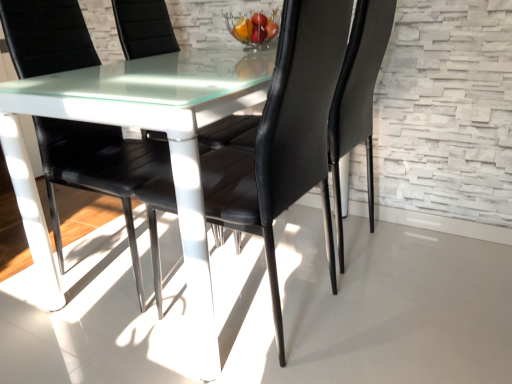
Question: Is black leather chair at center, the first chair viewed from the right, inside the boundaries of black leather chair at center, which is the 4th chair from right to left, or outside?

Choices:
 (A) outside
 (B) inside

Answer: (A)

Question: From the image's perspective, is black leather chair at center, the fourth chair in the left-to-right sequence, above or below black leather chair at center, the first chair positioned from the left?

Choices:
 (A) below
 (B) above

Answer: (B)

Question: Which object is the farthest from the black leather chair at center, arranged as the second chair when viewed from the right?

Choices:
 (A) black leather chair at center, the fourth chair in the left-to-right sequence
 (B) black leather chair at center, marked as the 2th chair in a left-to-right arrangement
 (C) black leather chair at center, the first chair positioned from the left

Answer: (B)

Question: Considering the real-world distances, which object is farthest from the black leather chair at center, which appears as the 3th chair when viewed from the right?

Choices:
 (A) black leather chair at center, the first chair viewed from the right
 (B) black leather chair at center, arranged as the second chair when viewed from the right
 (C) black leather chair at center, which is the 4th chair from right to left

Answer: (B)